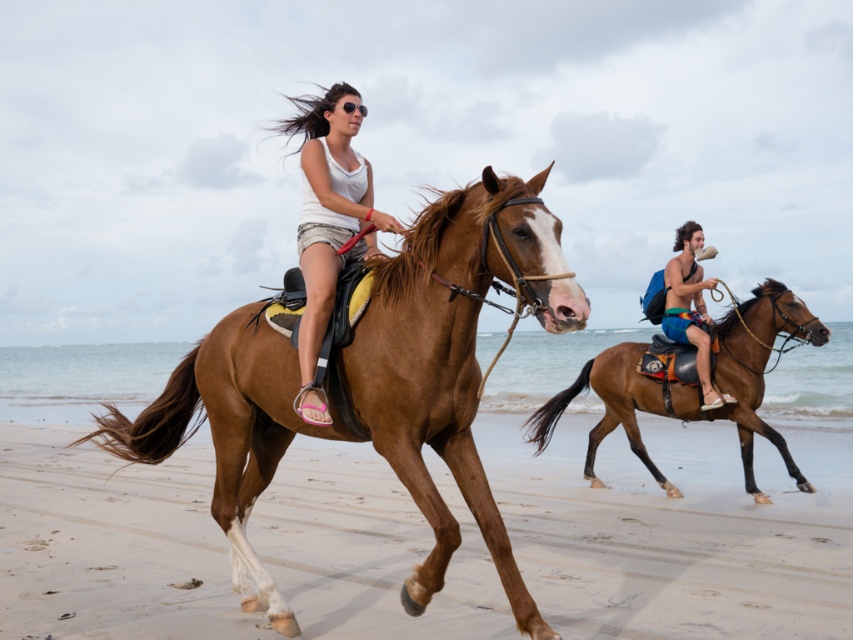
Which is behind, point (200, 458) or point (386, 451)?

The point (200, 458) is more distant.

Does point (318, 536) come closer to viewer compared to point (247, 490)?

No, it is behind (247, 490).

Between point (845, 500) and point (142, 428), which one is positioned in front?

Point (142, 428) is more forward.

The image size is (853, 640). I want to click on brown sand at lower center, so click(666, 548).

Between point (346, 435) and point (701, 365), which one is positioned behind?

The point (701, 365) is behind.

Who is lower down, brown glossy horse at left or blue fabric shorts at center?

brown glossy horse at left is lower down.

What do you see at coordinates (451, 358) in the screenshot? I see `brown glossy horse at left` at bounding box center [451, 358].

Locate an element on the screen. The width and height of the screenshot is (853, 640). brown glossy horse at left is located at coordinates (451, 358).

Who is positioned more to the right, brown sand at lower center or brown glossy horse at right?

Positioned to the right is brown glossy horse at right.

Measure the distance between point [830,538] and camera.

A distance of 6.82 meters exists between point [830,538] and camera.

Where is `brown sand at lower center`? Image resolution: width=853 pixels, height=640 pixels. brown sand at lower center is located at coordinates (666, 548).